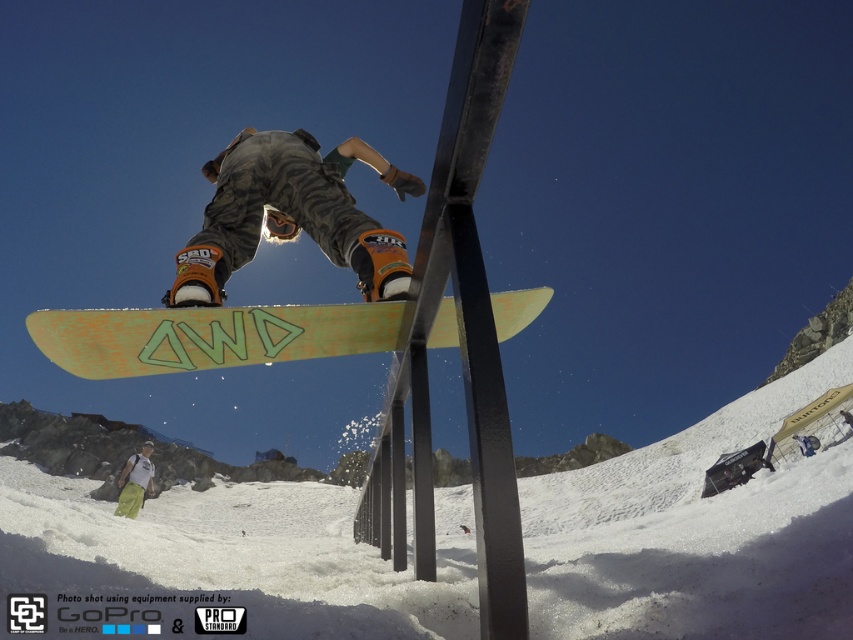
Does point (387, 332) come in front of point (283, 225)?

Yes, it is in front of point (283, 225).

Who is positioned more to the left, green matte snowboard at center or camouflage pants at center?

From the viewer's perspective, camouflage pants at center appears more on the left side.

What do you see at coordinates (212, 336) in the screenshot? Image resolution: width=853 pixels, height=640 pixels. I see `green matte snowboard at center` at bounding box center [212, 336].

At what (x,y) coordinates should I click in order to perform the action: click on green matte snowboard at center. Please return your answer as a coordinate pair (x, y). Image resolution: width=853 pixels, height=640 pixels. Looking at the image, I should click on (212, 336).

Describe the element at coordinates (697, 532) in the screenshot. The height and width of the screenshot is (640, 853). I see `yellow matte snowboard at center` at that location.

Between yellow matte snowboard at center and green matte snowboard at center, which one appears on the left side from the viewer's perspective?

yellow matte snowboard at center

Between point (337, 620) and point (201, 356), which one is positioned in front?

Point (337, 620)

In order to click on yellow matte snowboard at center in this screenshot , I will do [697, 532].

Does point (357, 260) come closer to viewer compared to point (146, 454)?

That is True.

Can you confirm if camouflage pants at center is positioned above green fabric pants at lower left?

Yes, camouflage pants at center is above green fabric pants at lower left.

Is point (410, 275) farther from camera compared to point (135, 456)?

No, it is not.

Identify the location of camouflage pants at center. This screenshot has width=853, height=640. (289, 214).